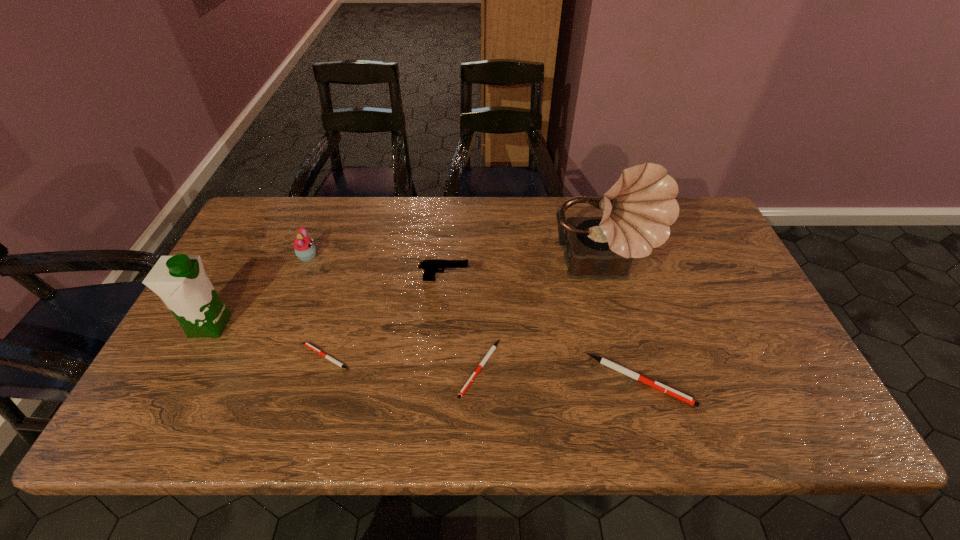
Where is `vacant area between the third shortest object and the third tallest object`? The image size is (960, 540). vacant area between the third shortest object and the third tallest object is located at coordinates (473, 319).

Identify the location of free point between the fourth tallest object and the tallest pen. (541, 330).

In order to click on vacant space in between the pistol and the soya milk in this screenshot , I will do `click(327, 302)`.

Image resolution: width=960 pixels, height=540 pixels. Find the location of `vacant area that lies between the leftmost pen and the third tallest object`. vacant area that lies between the leftmost pen and the third tallest object is located at coordinates (317, 307).

The image size is (960, 540). In order to click on vacant area between the record player and the leftmost object in this screenshot , I will do `click(406, 298)`.

Find the location of a particular element. This screenshot has height=540, width=960. object identified as the sixth closest to the sixth tallest object is located at coordinates (180, 281).

Locate which object is the fifth closest to the record player. Please provide its 2D coordinates. Your answer should be formatted as a tuple, i.e. [(x, y)], where the tuple contains the x and y coordinates of a point satisfying the conditions above.

[(305, 250)]

Identify which pen is the third nearest to the cupcake. Please provide its 2D coordinates. Your answer should be formatted as a tuple, i.e. [(x, y)], where the tuple contains the x and y coordinates of a point satisfying the conditions above.

[(610, 364)]

Point out which pen is positioned as the second nearest to the second tallest object. Please provide its 2D coordinates. Your answer should be formatted as a tuple, i.e. [(x, y)], where the tuple contains the x and y coordinates of a point satisfying the conditions above.

[(489, 353)]

Where is `vacant space that satisfies the following two spatial constraints: 1. from the horn of the tallest object; 2. on the front-facing side of the sixth shortest object`? vacant space that satisfies the following two spatial constraints: 1. from the horn of the tallest object; 2. on the front-facing side of the sixth shortest object is located at coordinates (617, 325).